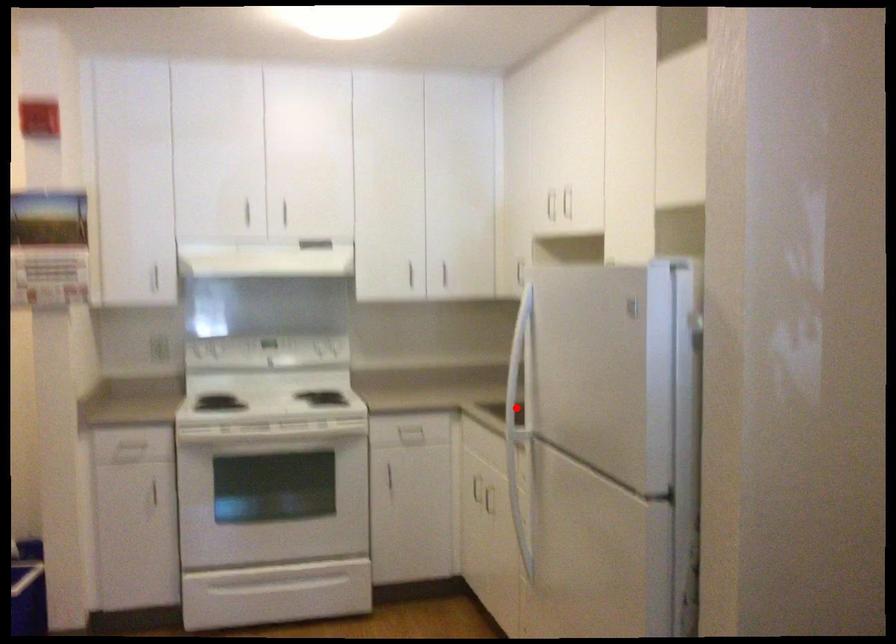
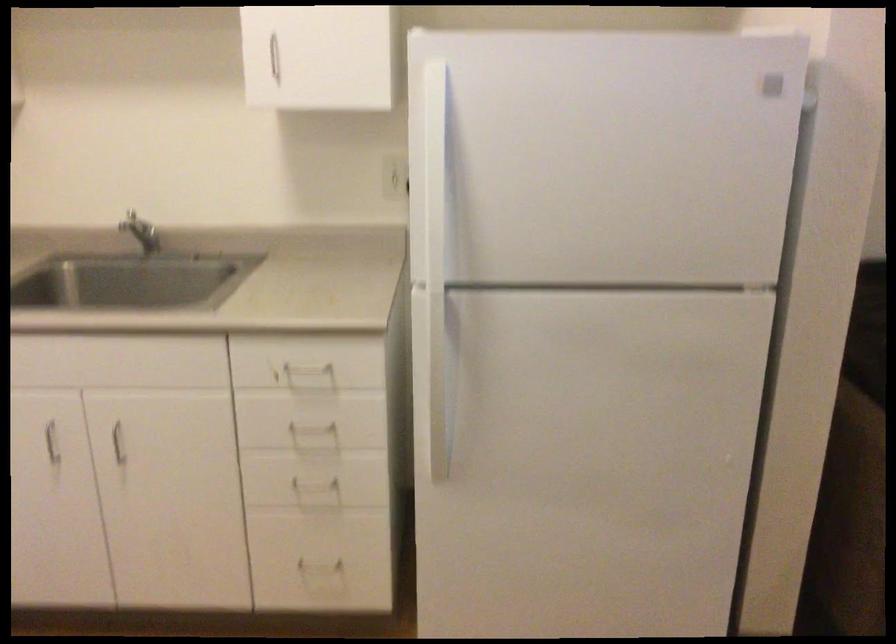
In the second image, find the point that corresponds to the highlighted location in the first image.

(435, 261)